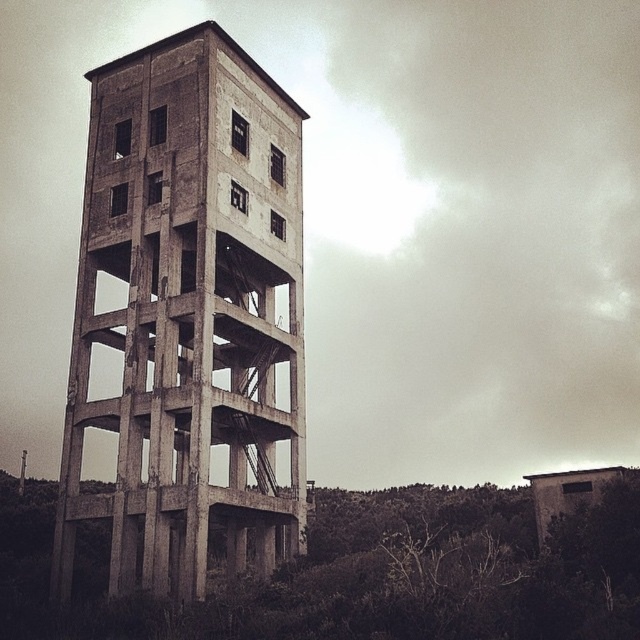
Question: Where is concrete tower at center located in relation to concrete structure at center in the image?

Choices:
 (A) below
 (B) above

Answer: (B)

Question: Which point is farther to the camera?

Choices:
 (A) concrete structure at center
 (B) concrete tower at center

Answer: (B)

Question: Is concrete tower at center to the left of concrete structure at center from the viewer's perspective?

Choices:
 (A) yes
 (B) no

Answer: (A)

Question: Is concrete tower at center positioned in front of concrete structure at center?

Choices:
 (A) no
 (B) yes

Answer: (A)